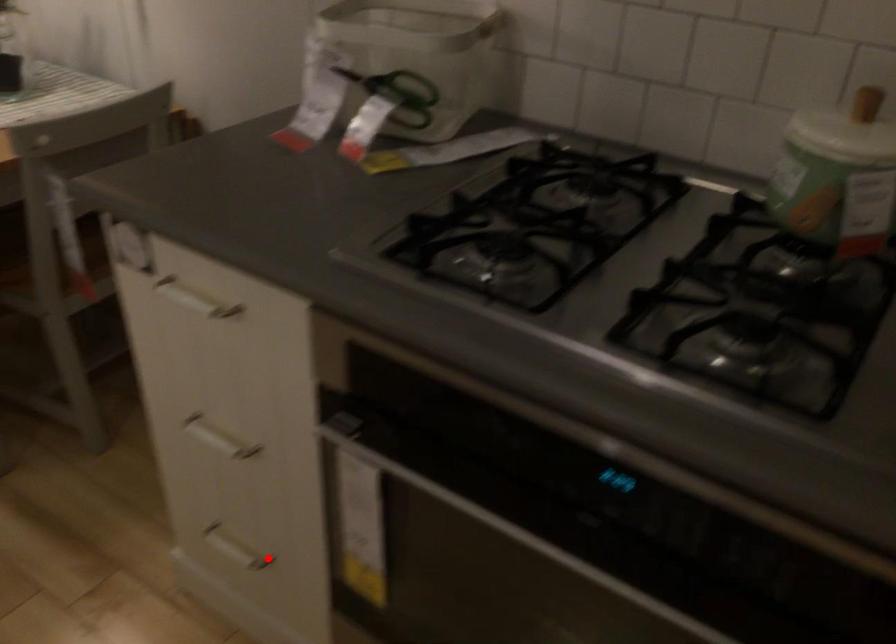
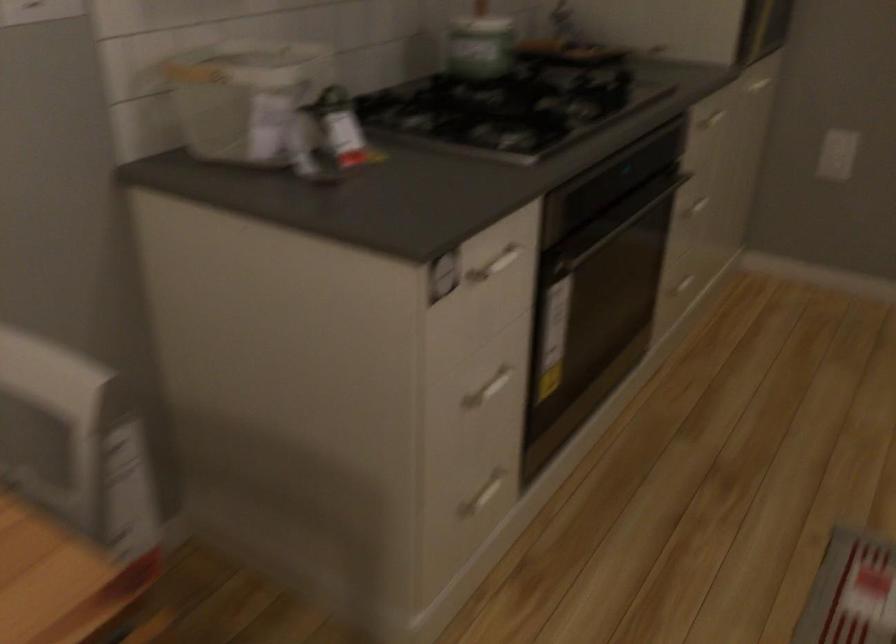
Where in the second image is the point corresponding to the highlighted location from the first image?

(484, 494)